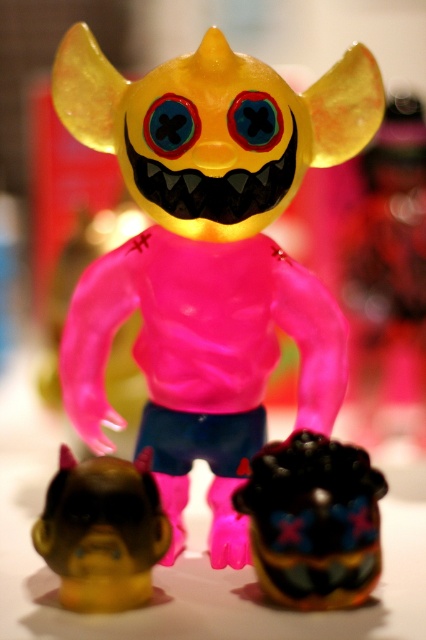
Question: Does translucent yellow toy at center have a smaller size compared to matte black toy head at lower center?

Choices:
 (A) yes
 (B) no

Answer: (B)

Question: Is the position of translucent yellow toy at center less distant than that of matte black toy head at lower center?

Choices:
 (A) yes
 (B) no

Answer: (B)

Question: Which point is closer to the camera?

Choices:
 (A) (63, 467)
 (B) (245, 189)
 (C) (317, 572)

Answer: (C)

Question: Among these points, which one is farthest from the camera?

Choices:
 (A) (146, 552)
 (B) (235, 291)

Answer: (B)

Question: Considering the relative positions of translucent yellow toy at center and brown matte head at lower left in the image provided, where is translucent yellow toy at center located with respect to brown matte head at lower left?

Choices:
 (A) above
 (B) below

Answer: (A)

Question: Which of the following is the closest to the observer?

Choices:
 (A) (97, 540)
 (B) (227, 173)

Answer: (A)